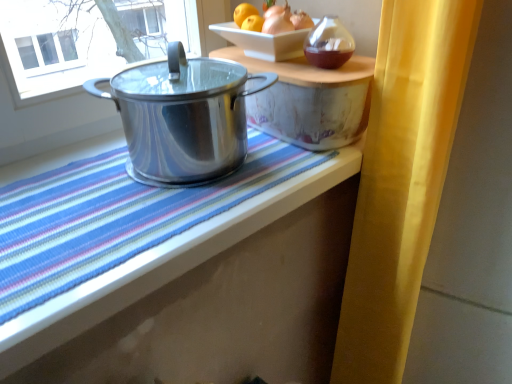
Identify the location of shiny metallic pot at left. The width and height of the screenshot is (512, 384). (183, 116).

I want to click on shiny metallic pot at center, which ranks as the first table in left-to-right order, so click(208, 297).

From a real-world perspective, is shiny metallic pot at right, acting as the second table starting from the left, over shiny metallic pot at left?

Incorrect, from a real-world perspective, shiny metallic pot at right, acting as the second table starting from the left, is lower than shiny metallic pot at left.

From the image's perspective, is shiny metallic pot at right, the first table from the right, above or below shiny metallic pot at left?

shiny metallic pot at right, the first table from the right, is above shiny metallic pot at left.

Find the location of a particular element. This screenshot has height=384, width=512. kitchen appliance that is in front of the shiny metallic pot at right, acting as the second table starting from the left is located at coordinates (183, 116).

Is point (292, 64) closer to viewer compared to point (208, 164)?

No, it is not.

Can you confirm if yellow fabric curtain at right is smaller than shiny metallic pot at left?

Incorrect, yellow fabric curtain at right is not smaller in size than shiny metallic pot at left.

In the image, is yellow fabric curtain at right on the left side or the right side of shiny metallic pot at left?

Based on their positions, yellow fabric curtain at right is located to the right of shiny metallic pot at left.

Between yellow fabric curtain at right and shiny metallic pot at left, which one has less height?

Standing shorter between the two is shiny metallic pot at left.

From the image's perspective, is yellow fabric curtain at right beneath shiny metallic pot at left?

Yes, from the image's perspective, yellow fabric curtain at right is below shiny metallic pot at left.

From a real-world perspective, is shiny metallic pot at right, acting as the second table starting from the left, on yellow fabric curtain at right?

Indeed, from a real-world perspective, shiny metallic pot at right, acting as the second table starting from the left, stands above yellow fabric curtain at right.

Considering the positions of point (348, 142) and point (394, 177), is point (348, 142) closer or farther from the camera than point (394, 177)?

Clearly, point (348, 142) is more distant from the camera than point (394, 177).

Looking at this image, which object is closer to the camera taking this photo, yellow fabric curtain at right or shiny metallic pot at right, acting as the second table starting from the left?

Positioned in front is yellow fabric curtain at right.

What's the angular difference between yellow fabric curtain at right and shiny metallic pot at right, acting as the second table starting from the left,'s facing directions?

The angular difference between yellow fabric curtain at right and shiny metallic pot at right, acting as the second table starting from the left, is 71.1 degrees.

Who is bigger, yellow fabric curtain at right or shiny metallic pot at right, acting as the second table starting from the left?

yellow fabric curtain at right.

Is yellow fabric curtain at right taller than shiny metallic pot at right, acting as the second table starting from the left?

Indeed, yellow fabric curtain at right has a greater height compared to shiny metallic pot at right, acting as the second table starting from the left.

Considering the positions of objects shiny metallic pot at center, marked as the second table in a right-to-left arrangement, and yellow fabric curtain at right in the image provided, who is more to the left, shiny metallic pot at center, marked as the second table in a right-to-left arrangement, or yellow fabric curtain at right?

shiny metallic pot at center, marked as the second table in a right-to-left arrangement.

Is yellow fabric curtain at right at the back of shiny metallic pot at center, marked as the second table in a right-to-left arrangement?

shiny metallic pot at center, marked as the second table in a right-to-left arrangement, is not turned away from yellow fabric curtain at right.

Which point is more forward, (183, 318) or (418, 226)?

Point (183, 318)

From the picture: Can you tell me how much shiny metallic pot at center, which ranks as the first table in left-to-right order, and yellow fabric curtain at right differ in facing direction?

They differ by 70.3 degrees in their facing directions.

Do you think shiny metallic pot at right, acting as the second table starting from the left, is within shiny metallic pot at center, marked as the second table in a right-to-left arrangement, or outside of it?

shiny metallic pot at right, acting as the second table starting from the left, is outside shiny metallic pot at center, marked as the second table in a right-to-left arrangement.

Is shiny metallic pot at right, acting as the second table starting from the left, facing away from shiny metallic pot at center, marked as the second table in a right-to-left arrangement?

No, shiny metallic pot at center, marked as the second table in a right-to-left arrangement, is not at the back of shiny metallic pot at right, acting as the second table starting from the left.

Which point is more forward, (309, 66) or (262, 227)?

Positioned in front is point (262, 227).

In the scene shown: How different are the orientations of shiny metallic pot at right, acting as the second table starting from the left, and shiny metallic pot at center, marked as the second table in a right-to-left arrangement, in degrees?

The angle between the facing direction of shiny metallic pot at right, acting as the second table starting from the left, and the facing direction of shiny metallic pot at center, marked as the second table in a right-to-left arrangement, is 0.855 degrees.

From the picture: Could you tell me if shiny metallic pot at left is facing shiny metallic pot at center, marked as the second table in a right-to-left arrangement?

No.

Can you tell me how much shiny metallic pot at left and shiny metallic pot at center, which ranks as the first table in left-to-right order, differ in facing direction?

The angular difference between shiny metallic pot at left and shiny metallic pot at center, which ranks as the first table in left-to-right order, is 1.67 degrees.

Considering their positions, is shiny metallic pot at left located in front of or behind shiny metallic pot at center, marked as the second table in a right-to-left arrangement?

Visually, shiny metallic pot at left is located behind shiny metallic pot at center, marked as the second table in a right-to-left arrangement.

From a real-world perspective, count 2nd tables downward from the shiny metallic pot at left and point to it. Please provide its 2D coordinates.

[(208, 297)]

Find the location of a particular element. The width and height of the screenshot is (512, 384). kitchen appliance below the shiny metallic pot at right, acting as the second table starting from the left (from the image's perspective) is located at coordinates (183, 116).

Identify the location of kitchen appliance behind the yellow fabric curtain at right. [x=183, y=116].

Based on their spatial positions, is yellow fabric curtain at right or shiny metallic pot at right, the first table from the right, closer to shiny metallic pot at left?

shiny metallic pot at right, the first table from the right, is closer to shiny metallic pot at left.

Looking at the image, which one is located further to yellow fabric curtain at right, shiny metallic pot at left or shiny metallic pot at center, which ranks as the first table in left-to-right order?

shiny metallic pot at left.

Looking at the image, which one is located closer to shiny metallic pot at left, yellow fabric curtain at right or shiny metallic pot at center, marked as the second table in a right-to-left arrangement?

The object closer to shiny metallic pot at left is shiny metallic pot at center, marked as the second table in a right-to-left arrangement.

Looking at this image, estimate the real-world distances between objects in this image. Which object is further from shiny metallic pot at left, shiny metallic pot at center, which ranks as the first table in left-to-right order, or yellow fabric curtain at right?

yellow fabric curtain at right lies further to shiny metallic pot at left than the other object.

Considering their positions, is shiny metallic pot at right, acting as the second table starting from the left, positioned closer to shiny metallic pot at center, marked as the second table in a right-to-left arrangement, than shiny metallic pot at left?

shiny metallic pot at left.

From the image, which object appears to be nearer to shiny metallic pot at right, the first table from the right, yellow fabric curtain at right or shiny metallic pot at center, marked as the second table in a right-to-left arrangement?

Based on the image, yellow fabric curtain at right appears to be nearer to shiny metallic pot at right, the first table from the right.

Estimate the real-world distances between objects in this image. Which object is further from shiny metallic pot at right, the first table from the right, shiny metallic pot at left or shiny metallic pot at center, which ranks as the first table in left-to-right order?

Among the two, shiny metallic pot at center, which ranks as the first table in left-to-right order, is located further to shiny metallic pot at right, the first table from the right.

Based on their spatial positions, is shiny metallic pot at right, the first table from the right, or shiny metallic pot at left further from yellow fabric curtain at right?

shiny metallic pot at left lies further to yellow fabric curtain at right than the other object.

Identify the location of table between shiny metallic pot at left and yellow fabric curtain at right from left to right. (309, 100).

Locate an element on the screen. This screenshot has width=512, height=384. kitchen appliance between shiny metallic pot at center, which ranks as the first table in left-to-right order, and yellow fabric curtain at right from left to right is located at coordinates (183, 116).

Identify the location of kitchen appliance between shiny metallic pot at center, marked as the second table in a right-to-left arrangement, and shiny metallic pot at right, the first table from the right, from left to right. (183, 116).

Find the location of a particular element. table between shiny metallic pot at center, marked as the second table in a right-to-left arrangement, and yellow fabric curtain at right, in the horizontal direction is located at coordinates (309, 100).